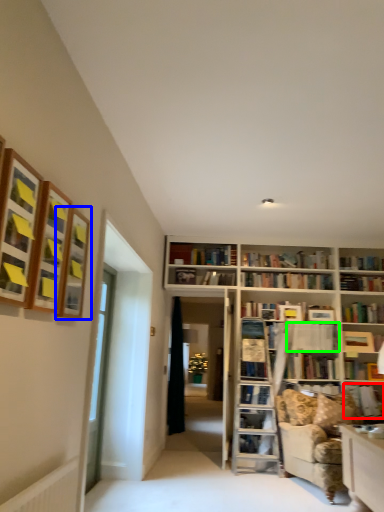
Question: Which is nearer to the book (highlighted by a red box)? shelf (highlighted by a blue box) or book (highlighted by a green box).

Choices:
 (A) shelf
 (B) book

Answer: (B)